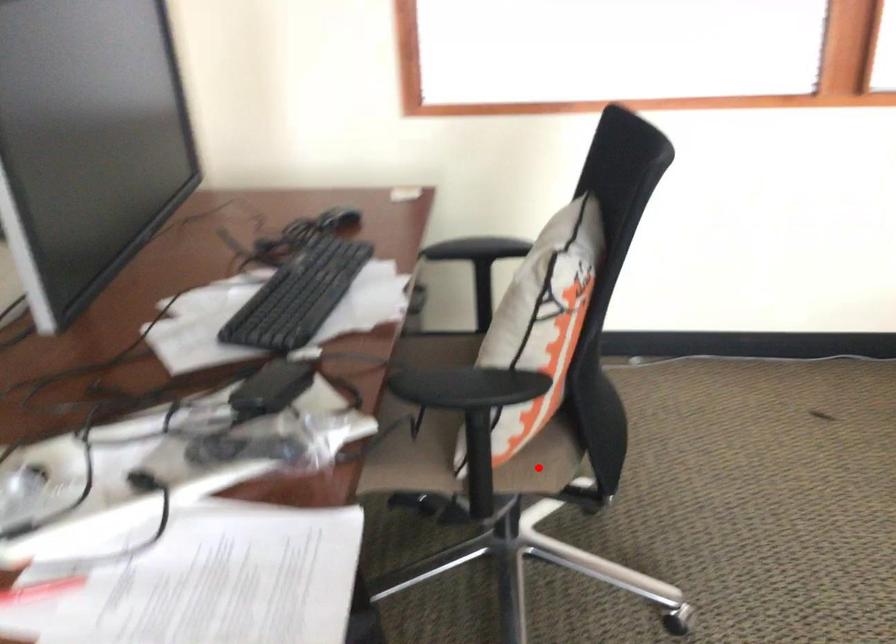
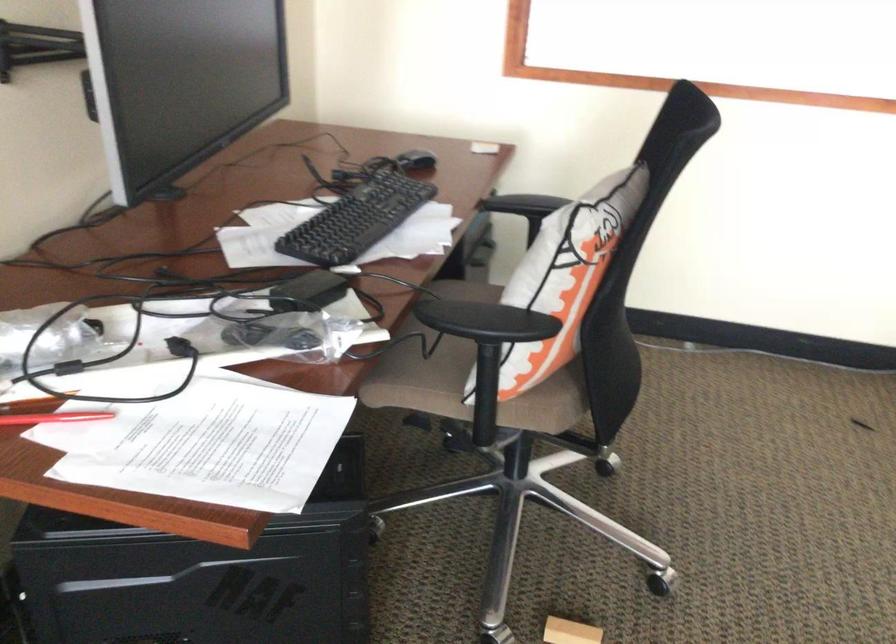
Locate, in the second image, the point that corresponds to the highlighted location in the first image.

(543, 408)